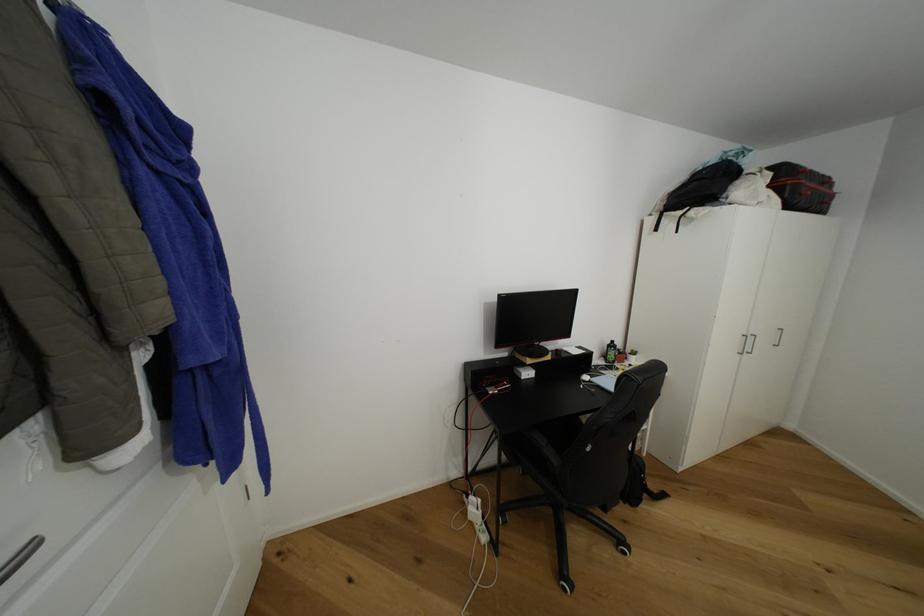
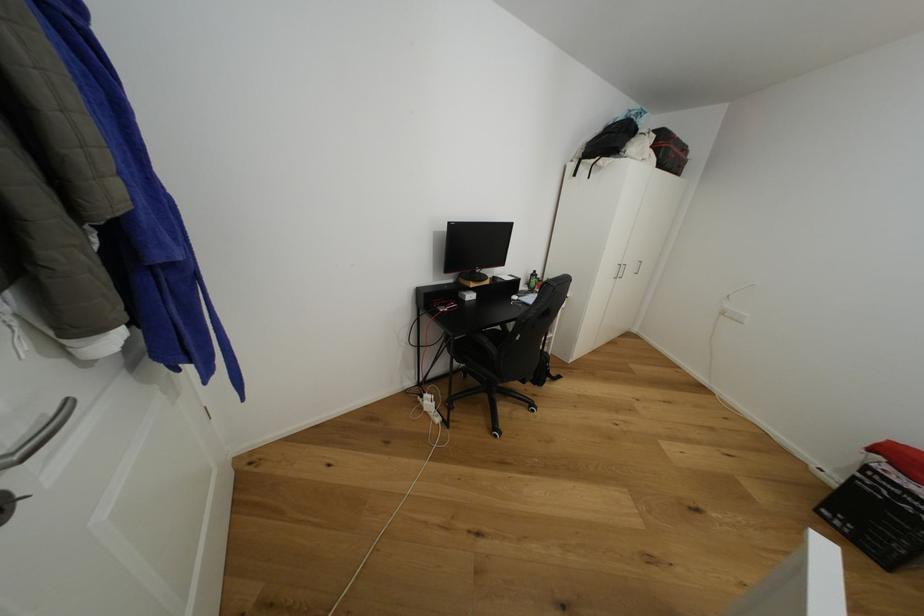
What movement of the cameraman would produce the second image?

The cameraman moved toward left, backward.